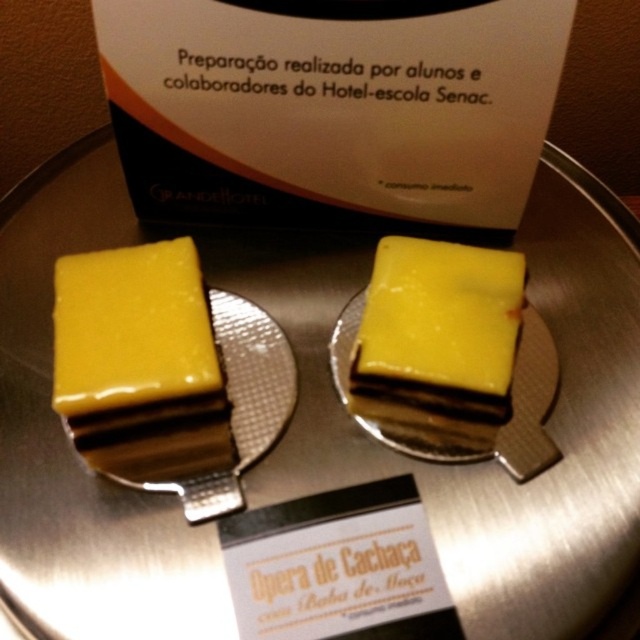
Question: Is the position of yellow glossy cake at left less distant than that of yellow glossy cake at center?

Choices:
 (A) yes
 (B) no

Answer: (A)

Question: Does yellow glossy cake at left have a lesser width compared to yellow glossy cake at center?

Choices:
 (A) no
 (B) yes

Answer: (B)

Question: From the image, what is the correct spatial relationship of yellow glossy cake at left in relation to yellow glossy cake at center?

Choices:
 (A) above
 (B) below

Answer: (B)

Question: Which object is farther from the camera taking this photo?

Choices:
 (A) yellow glossy cake at center
 (B) yellow glossy cake at left

Answer: (A)

Question: Among these objects, which one is farthest from the camera?

Choices:
 (A) yellow glossy cake at center
 (B) yellow glossy cake at left

Answer: (A)